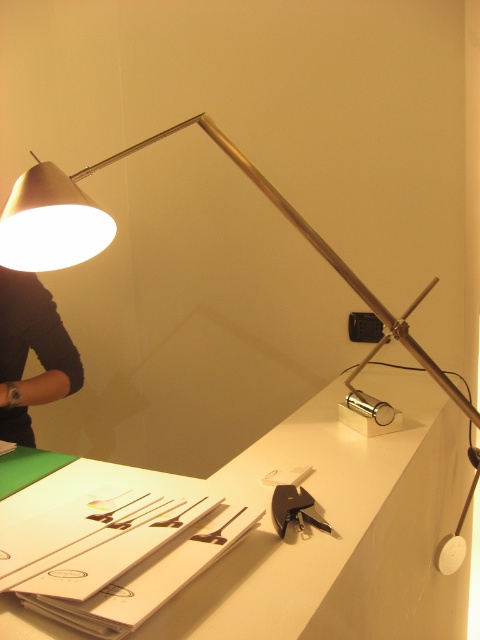
Does white glossy table at center have a larger size compared to metallic keychain at lower center?

Indeed, white glossy table at center has a larger size compared to metallic keychain at lower center.

Who is more forward, (387,604) or (275,488)?

Point (275,488) is in front.

Is point (393, 518) positioned after point (301, 499)?

Yes, it is.

The height and width of the screenshot is (640, 480). I want to click on white glossy table at center, so click(x=342, y=529).

Is black fabric arm at upper left further to camera compared to metallic keychain at lower center?

That is True.

Does black fabric arm at upper left have a larger size compared to metallic keychain at lower center?

Indeed, black fabric arm at upper left has a larger size compared to metallic keychain at lower center.

Describe the element at coordinates (34, 349) in the screenshot. This screenshot has width=480, height=640. I see `black fabric arm at upper left` at that location.

The height and width of the screenshot is (640, 480). Identify the location of black fabric arm at upper left. (34, 349).

Which is behind, point (88, 221) or point (275, 520)?

The point (88, 221) is more distant.

Who is lower down, matte silver lamp at upper left or metallic keychain at lower center?

Positioned lower is metallic keychain at lower center.

I want to click on matte silver lamp at upper left, so click(x=115, y=227).

You are a GUI agent. You are given a task and a screenshot of the screen. Output one action in this format:
    pyautogui.click(x=<x>, y=<y>)
    Task: Click on the matte silver lamp at upper left
    
    Given the screenshot: What is the action you would take?
    pyautogui.click(x=115, y=227)